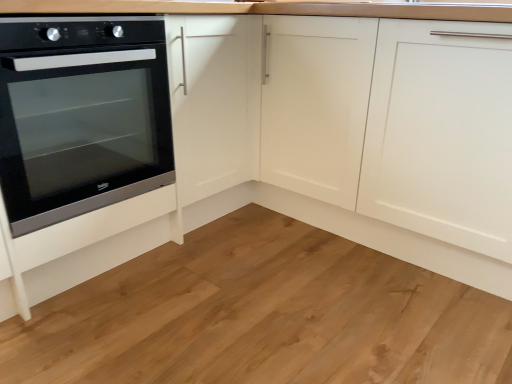
Locate an element on the screen. The height and width of the screenshot is (384, 512). black glass oven at left is located at coordinates (x=81, y=116).

Describe the element at coordinates (81, 116) in the screenshot. The width and height of the screenshot is (512, 384). I see `black glass oven at left` at that location.

The height and width of the screenshot is (384, 512). I want to click on natural wood flooring at lower left, so click(262, 316).

What is the approximate height of natural wood flooring at lower left?

The height of natural wood flooring at lower left is 0.78 inches.

What do you see at coordinates (262, 316) in the screenshot? I see `natural wood flooring at lower left` at bounding box center [262, 316].

This screenshot has height=384, width=512. What are the coordinates of `black glass oven at left` in the screenshot? It's located at (81, 116).

Does black glass oven at left appear on the right side of natural wood flooring at lower left?

No.

Is black glass oven at left in front of or behind natural wood flooring at lower left in the image?

black glass oven at left is behind natural wood flooring at lower left.

Which is closer to the camera, (81, 85) or (396, 305)?

Point (81, 85) is positioned farther from the camera compared to point (396, 305).

From the image's perspective, is black glass oven at left above natural wood flooring at lower left?

Yes, from the image's perspective, black glass oven at left is over natural wood flooring at lower left.

From a real-world perspective, between black glass oven at left and natural wood flooring at lower left, who is vertically lower?

natural wood flooring at lower left, from a real-world perspective.

Considering the sizes of black glass oven at left and natural wood flooring at lower left in the image, is black glass oven at left wider or thinner than natural wood flooring at lower left?

In the image, black glass oven at left appears to be more narrow than natural wood flooring at lower left.

Is black glass oven at left taller than natural wood flooring at lower left?

Yes.

Which of these two, black glass oven at left or natural wood flooring at lower left, is bigger?

black glass oven at left.

Is black glass oven at left located outside natural wood flooring at lower left?

Indeed, black glass oven at left is completely outside natural wood flooring at lower left.

Is the surface of black glass oven at left in direct contact with natural wood flooring at lower left?

No, black glass oven at left is not touching natural wood flooring at lower left.

Is black glass oven at left looking in the opposite direction of natural wood flooring at lower left?

No, natural wood flooring at lower left is not at the back of black glass oven at left.

Can you tell me how much black glass oven at left and natural wood flooring at lower left differ in facing direction?

0.173 degrees.

The image size is (512, 384). Find the location of `oven on the left side of natural wood flooring at lower left`. oven on the left side of natural wood flooring at lower left is located at coordinates (81, 116).

Which is more to the left, natural wood flooring at lower left or black glass oven at left?

From the viewer's perspective, black glass oven at left appears more on the left side.

Considering their positions, is natural wood flooring at lower left located in front of or behind black glass oven at left?

In the image, natural wood flooring at lower left appears in front of black glass oven at left.

Is point (461, 294) farther from viewer compared to point (16, 160)?

Yes, it is.

From the image's perspective, relative to black glass oven at left, is natural wood flooring at lower left above or below?

Clearly, from the image's perspective, natural wood flooring at lower left is below black glass oven at left.

From a real-world perspective, who is located lower, natural wood flooring at lower left or black glass oven at left?

In real-world perspective, natural wood flooring at lower left is lower.

Based on the photo, between natural wood flooring at lower left and black glass oven at left, which one has smaller width?

black glass oven at left is thinner.

Considering the sizes of natural wood flooring at lower left and black glass oven at left in the image, is natural wood flooring at lower left taller or shorter than black glass oven at left?

Clearly, natural wood flooring at lower left is shorter compared to black glass oven at left.

Which of these two, natural wood flooring at lower left or black glass oven at left, is bigger?

black glass oven at left.

Is natural wood flooring at lower left located outside black glass oven at left?

Indeed, natural wood flooring at lower left is completely outside black glass oven at left.

Is natural wood flooring at lower left far away from black glass oven at left?

Yes, natural wood flooring at lower left and black glass oven at left are located far from each other.

Is natural wood flooring at lower left aimed at black glass oven at left?

No, natural wood flooring at lower left is not oriented towards black glass oven at left.

The width and height of the screenshot is (512, 384). What are the coordinates of `oven located above the natural wood flooring at lower left (from a real-world perspective)` in the screenshot? It's located at (81, 116).

Find the location of a particular element. The image size is (512, 384). hardwood on the right of black glass oven at left is located at coordinates (262, 316).

Identify the location of oven above the natural wood flooring at lower left (from a real-world perspective). This screenshot has height=384, width=512. (81, 116).